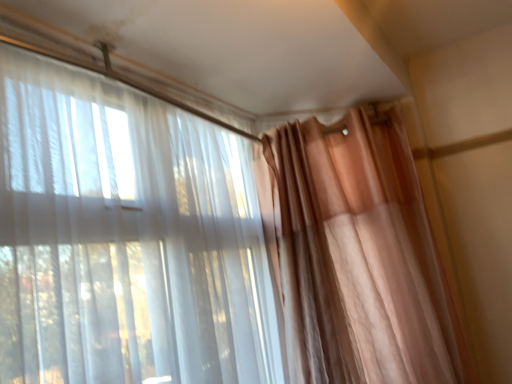
How much space does matte peach curtain at right, positioned as the 1th curtain in right-to-left order, occupy horizontally?

matte peach curtain at right, positioned as the 1th curtain in right-to-left order, is 20.07 inches in width.

This screenshot has width=512, height=384. In order to click on matte peach curtain at right, positioned as the 2th curtain in left-to-right order in this screenshot , I will do `click(356, 255)`.

Describe the element at coordinates (356, 255) in the screenshot. I see `matte peach curtain at right, positioned as the 1th curtain in right-to-left order` at that location.

Image resolution: width=512 pixels, height=384 pixels. What do you see at coordinates (126, 238) in the screenshot? I see `sheer white curtain at left, the 1th curtain from the left` at bounding box center [126, 238].

This screenshot has height=384, width=512. I want to click on sheer white curtain at left, which ranks as the 2th curtain in right-to-left order, so click(126, 238).

This screenshot has height=384, width=512. I want to click on matte peach curtain at right, positioned as the 1th curtain in right-to-left order, so click(356, 255).

From the picture: Is matte peach curtain at right, positioned as the 1th curtain in right-to-left order, at the right side of sheer white curtain at left, the 1th curtain from the left?

Yes, matte peach curtain at right, positioned as the 1th curtain in right-to-left order, is to the right of sheer white curtain at left, the 1th curtain from the left.

Between matte peach curtain at right, positioned as the 1th curtain in right-to-left order, and sheer white curtain at left, which ranks as the 2th curtain in right-to-left order, which one is positioned in front?

Positioned in front is sheer white curtain at left, which ranks as the 2th curtain in right-to-left order.

Between point (452, 302) and point (48, 181), which one is positioned in front?

Positioned in front is point (48, 181).

From the image's perspective, relative to sheer white curtain at left, which ranks as the 2th curtain in right-to-left order, is matte peach curtain at right, positioned as the 2th curtain in left-to-right order, above or below?

Based on their image positions, matte peach curtain at right, positioned as the 2th curtain in left-to-right order, is located beneath sheer white curtain at left, which ranks as the 2th curtain in right-to-left order.

From a real-world perspective, is matte peach curtain at right, positioned as the 1th curtain in right-to-left order, positioned over sheer white curtain at left, which ranks as the 2th curtain in right-to-left order, based on gravity?

No, from a real-world perspective, matte peach curtain at right, positioned as the 1th curtain in right-to-left order, is not on top of sheer white curtain at left, which ranks as the 2th curtain in right-to-left order.

Is matte peach curtain at right, positioned as the 2th curtain in left-to-right order, wider or thinner than sheer white curtain at left, which ranks as the 2th curtain in right-to-left order?

In the image, matte peach curtain at right, positioned as the 2th curtain in left-to-right order, appears to be wider than sheer white curtain at left, which ranks as the 2th curtain in right-to-left order.

Considering the sizes of objects matte peach curtain at right, positioned as the 1th curtain in right-to-left order, and sheer white curtain at left, the 1th curtain from the left, in the image provided, who is shorter, matte peach curtain at right, positioned as the 1th curtain in right-to-left order, or sheer white curtain at left, the 1th curtain from the left,?

sheer white curtain at left, the 1th curtain from the left.

Does matte peach curtain at right, positioned as the 2th curtain in left-to-right order, have a smaller size compared to sheer white curtain at left, the 1th curtain from the left?

No, matte peach curtain at right, positioned as the 2th curtain in left-to-right order, is not smaller than sheer white curtain at left, the 1th curtain from the left.

Do you think matte peach curtain at right, positioned as the 1th curtain in right-to-left order, is within sheer white curtain at left, the 1th curtain from the left, or outside of it?

matte peach curtain at right, positioned as the 1th curtain in right-to-left order, is located beyond the bounds of sheer white curtain at left, the 1th curtain from the left.

Is matte peach curtain at right, positioned as the 2th curtain in left-to-right order, in contact with sheer white curtain at left, which ranks as the 2th curtain in right-to-left order?

No, matte peach curtain at right, positioned as the 2th curtain in left-to-right order, is not touching sheer white curtain at left, which ranks as the 2th curtain in right-to-left order.

Is matte peach curtain at right, positioned as the 1th curtain in right-to-left order, aimed at sheer white curtain at left, the 1th curtain from the left?

No.

How distant is matte peach curtain at right, positioned as the 1th curtain in right-to-left order, from sheer white curtain at left, which ranks as the 2th curtain in right-to-left order?

They are 20.38 inches apart.

The image size is (512, 384). Identify the location of curtain above the matte peach curtain at right, positioned as the 1th curtain in right-to-left order (from the image's perspective). (126, 238).

Can you confirm if sheer white curtain at left, which ranks as the 2th curtain in right-to-left order, is positioned to the right of matte peach curtain at right, positioned as the 1th curtain in right-to-left order?

In fact, sheer white curtain at left, which ranks as the 2th curtain in right-to-left order, is to the left of matte peach curtain at right, positioned as the 1th curtain in right-to-left order.

Is sheer white curtain at left, the 1th curtain from the left, closer to the viewer compared to matte peach curtain at right, positioned as the 2th curtain in left-to-right order?

That is True.

Is point (88, 171) closer to camera compared to point (464, 361)?

Yes, it is in front of point (464, 361).

From the image's perspective, relative to matte peach curtain at right, positioned as the 1th curtain in right-to-left order, is sheer white curtain at left, the 1th curtain from the left, above or below?

Clearly, from the image's perspective, sheer white curtain at left, the 1th curtain from the left, is above matte peach curtain at right, positioned as the 1th curtain in right-to-left order.

From a real-world perspective, is sheer white curtain at left, which ranks as the 2th curtain in right-to-left order, physically located above or below matte peach curtain at right, positioned as the 2th curtain in left-to-right order?

sheer white curtain at left, which ranks as the 2th curtain in right-to-left order, is situated higher than matte peach curtain at right, positioned as the 2th curtain in left-to-right order, in the real world.

Does sheer white curtain at left, which ranks as the 2th curtain in right-to-left order, have a lesser width compared to matte peach curtain at right, positioned as the 1th curtain in right-to-left order?

Correct, the width of sheer white curtain at left, which ranks as the 2th curtain in right-to-left order, is less than that of matte peach curtain at right, positioned as the 1th curtain in right-to-left order.

Who is shorter, sheer white curtain at left, which ranks as the 2th curtain in right-to-left order, or matte peach curtain at right, positioned as the 2th curtain in left-to-right order?

sheer white curtain at left, which ranks as the 2th curtain in right-to-left order, is shorter.

From the picture: Can you confirm if sheer white curtain at left, which ranks as the 2th curtain in right-to-left order, is smaller than matte peach curtain at right, positioned as the 2th curtain in left-to-right order?

Indeed, sheer white curtain at left, which ranks as the 2th curtain in right-to-left order, has a smaller size compared to matte peach curtain at right, positioned as the 2th curtain in left-to-right order.

Can we say sheer white curtain at left, which ranks as the 2th curtain in right-to-left order, lies outside matte peach curtain at right, positioned as the 2th curtain in left-to-right order?

That's correct, sheer white curtain at left, which ranks as the 2th curtain in right-to-left order, is outside of matte peach curtain at right, positioned as the 2th curtain in left-to-right order.

Is sheer white curtain at left, which ranks as the 2th curtain in right-to-left order, positioned far away from matte peach curtain at right, positioned as the 1th curtain in right-to-left order?

Actually, sheer white curtain at left, which ranks as the 2th curtain in right-to-left order, and matte peach curtain at right, positioned as the 1th curtain in right-to-left order, are a little close together.

Could you tell me if sheer white curtain at left, which ranks as the 2th curtain in right-to-left order, is turned towards matte peach curtain at right, positioned as the 2th curtain in left-to-right order?

Yes, sheer white curtain at left, which ranks as the 2th curtain in right-to-left order, is turned towards matte peach curtain at right, positioned as the 2th curtain in left-to-right order.

How different are the orientations of sheer white curtain at left, which ranks as the 2th curtain in right-to-left order, and matte peach curtain at right, positioned as the 1th curtain in right-to-left order, in degrees?

47 degrees.

The width and height of the screenshot is (512, 384). In order to click on curtain on the left of matte peach curtain at right, positioned as the 1th curtain in right-to-left order in this screenshot , I will do `click(126, 238)`.

Locate an element on the screen. The image size is (512, 384). curtain in front of the matte peach curtain at right, positioned as the 2th curtain in left-to-right order is located at coordinates (126, 238).

This screenshot has height=384, width=512. In order to click on curtain above the matte peach curtain at right, positioned as the 1th curtain in right-to-left order (from a real-world perspective) in this screenshot , I will do `click(126, 238)`.